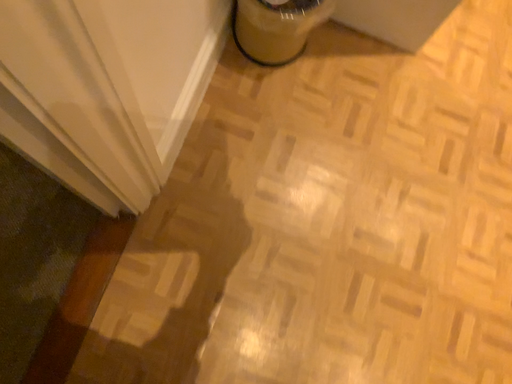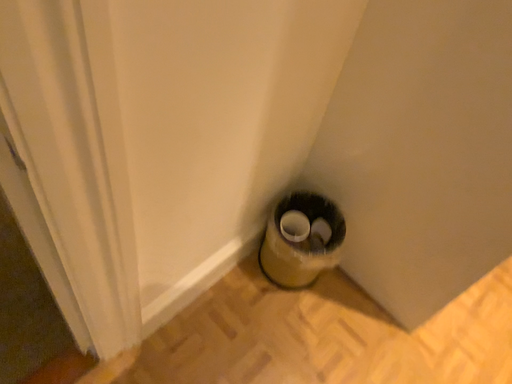
Question: How did the camera likely rotate when shooting the video?

Choices:
 (A) rotated downward
 (B) rotated upward

Answer: (B)